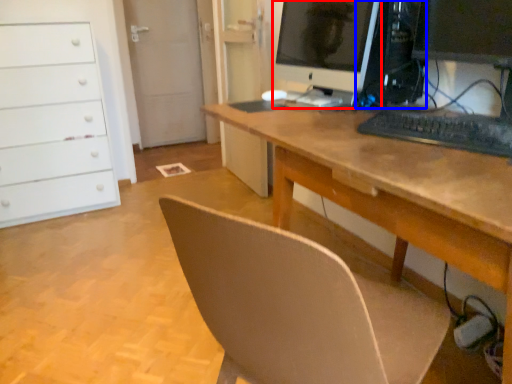
Question: Which point is closer to the camera, computer monitor (highlighted by a red box) or desktop computer (highlighted by a blue box)?

Choices:
 (A) computer monitor
 (B) desktop computer

Answer: (A)